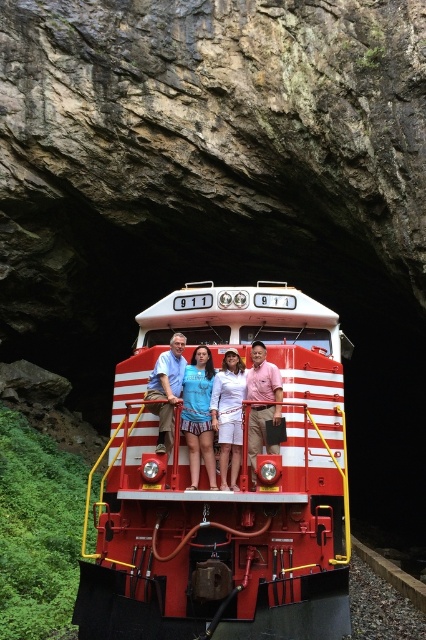
What is the 2D coordinate of the shiny red train at center?

The shiny red train at center is located at the 2D coordinate point of (x=224, y=484).

You are a photographer trying to capture a clear photo of the matte blue shorts at center and the matte white shirt at center. Since the cave is dark, you need to adjust your camera settings. Which object should you focus on first to ensure it appears sharp in the photo?

The matte blue shorts at center is much taller than the matte white shirt at center, so you should focus on the matte blue shorts at center first since it is larger and more prominent in the frame.